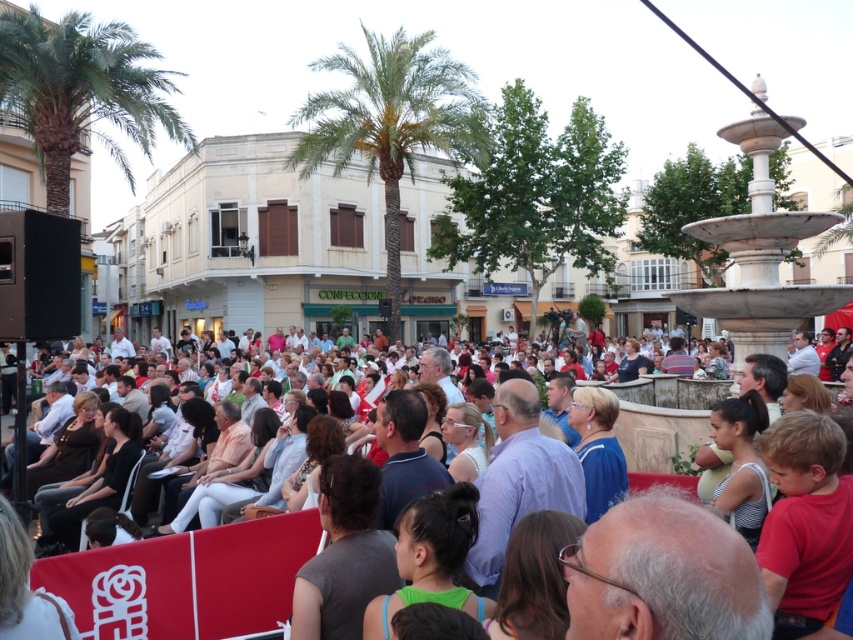
Question: Which point appears closest to the camera in this image?

Choices:
 (A) coord(204,605)
 (B) coord(782,307)

Answer: (A)

Question: Which object is the farthest from the white marble fountain at right?

Choices:
 (A) matte white crowd at center
 (B) green leafy palm tree at upper left
 (C) green leafy palm tree at center

Answer: (B)

Question: Which point appears closest to the camera in this image?

Choices:
 (A) (720, 310)
 (B) (86, 621)
 (C) (49, 56)
 (D) (347, 116)

Answer: (B)

Question: Is green leafy palm tree at center to the left of green leafy palm tree at upper left from the viewer's perspective?

Choices:
 (A) yes
 (B) no

Answer: (B)

Question: Is green leafy palm tree at center closer to the viewer compared to white marble fountain at right?

Choices:
 (A) no
 (B) yes

Answer: (A)

Question: Is green leafy palm tree at center above matte white crowd at center?

Choices:
 (A) no
 (B) yes

Answer: (B)